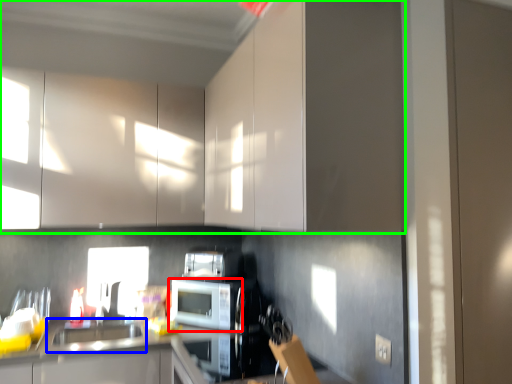
Question: Considering the real-world distances, which object is closest to microwave oven (highlighted by a red box)? sink (highlighted by a blue box) or cabinetry (highlighted by a green box).

Choices:
 (A) sink
 (B) cabinetry

Answer: (A)